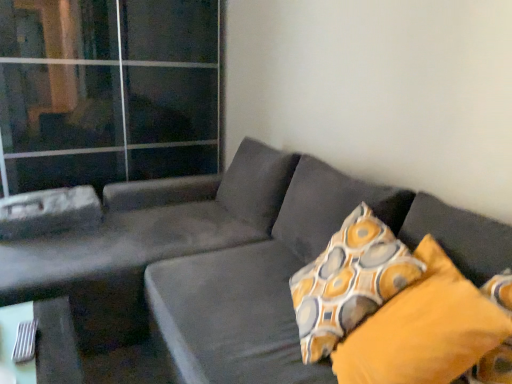
Question: Considering the relative sizes of transparent glass door at upper left and patterned fabric pillow at right, placed as the 2th pillow when sorted from front to back, in the image provided, is transparent glass door at upper left smaller than patterned fabric pillow at right, placed as the 2th pillow when sorted from front to back,?

Choices:
 (A) yes
 (B) no

Answer: (B)

Question: Is transparent glass door at upper left turned away from patterned fabric pillow at right, placed as the 2th pillow when sorted from front to back?

Choices:
 (A) no
 (B) yes

Answer: (A)

Question: Considering the relative sizes of transparent glass door at upper left and patterned fabric pillow at right, which is counted as the 1th pillow, starting from the back, in the image provided, is transparent glass door at upper left thinner than patterned fabric pillow at right, which is counted as the 1th pillow, starting from the back,?

Choices:
 (A) yes
 (B) no

Answer: (B)

Question: Does transparent glass door at upper left appear on the right side of patterned fabric pillow at right, placed as the 2th pillow when sorted from front to back?

Choices:
 (A) no
 (B) yes

Answer: (A)

Question: Is transparent glass door at upper left far away from patterned fabric pillow at right, placed as the 2th pillow when sorted from front to back?

Choices:
 (A) no
 (B) yes

Answer: (B)

Question: Is transparent glass door at upper left next to patterned fabric pillow at right, placed as the 2th pillow when sorted from front to back?

Choices:
 (A) yes
 (B) no

Answer: (B)

Question: Is velvet dark gray couch at center not close to yellow fabric pillow at right, marked as the 2th pillow in a back-to-front arrangement?

Choices:
 (A) no
 (B) yes

Answer: (A)

Question: From the image's perspective, is velvet dark gray couch at center on top of yellow fabric pillow at right, marked as the 2th pillow in a back-to-front arrangement?

Choices:
 (A) no
 (B) yes

Answer: (B)

Question: Is the position of velvet dark gray couch at center more distant than that of yellow fabric pillow at right, marked as the 2th pillow in a back-to-front arrangement?

Choices:
 (A) yes
 (B) no

Answer: (B)

Question: Considering the relative sizes of velvet dark gray couch at center and yellow fabric pillow at right, marked as the 2th pillow in a back-to-front arrangement, in the image provided, is velvet dark gray couch at center taller than yellow fabric pillow at right, marked as the 2th pillow in a back-to-front arrangement,?

Choices:
 (A) no
 (B) yes

Answer: (B)

Question: Is yellow fabric pillow at right, marked as the 2th pillow in a back-to-front arrangement, completely or partially inside velvet dark gray couch at center?

Choices:
 (A) yes
 (B) no

Answer: (A)

Question: Considering the relative sizes of velvet dark gray couch at center and yellow fabric pillow at right, which is the 1th pillow from front to back, in the image provided, is velvet dark gray couch at center shorter than yellow fabric pillow at right, which is the 1th pillow from front to back,?

Choices:
 (A) no
 (B) yes

Answer: (A)

Question: Considering the relative sizes of patterned fabric pillow at right, which is counted as the 1th pillow, starting from the back, and velvet dark gray couch at center in the image provided, is patterned fabric pillow at right, which is counted as the 1th pillow, starting from the back, taller than velvet dark gray couch at center?

Choices:
 (A) yes
 (B) no

Answer: (B)